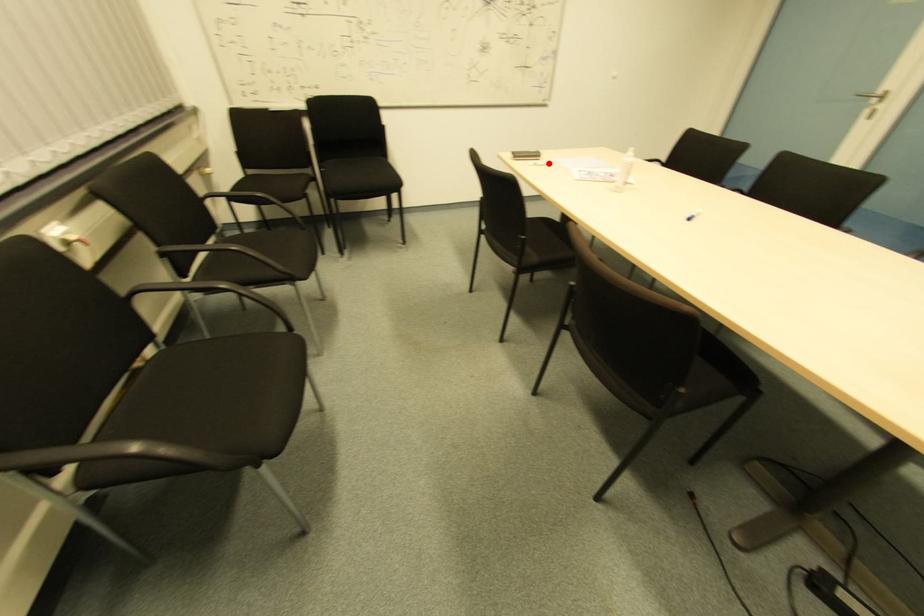
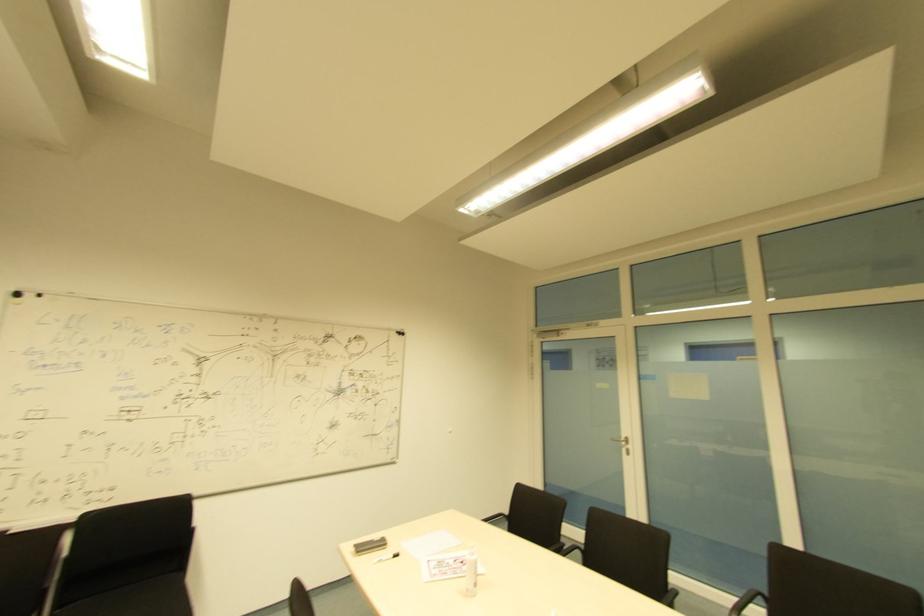
Question: I am providing you with two images of the same scene from different viewpoints. Image1 has a red point marked. In image2, the corresponding 3D location appears at what relative position? Reply with the corresponding letter.

Choices:
 (A) Closer
 (B) Farther

Answer: (B)